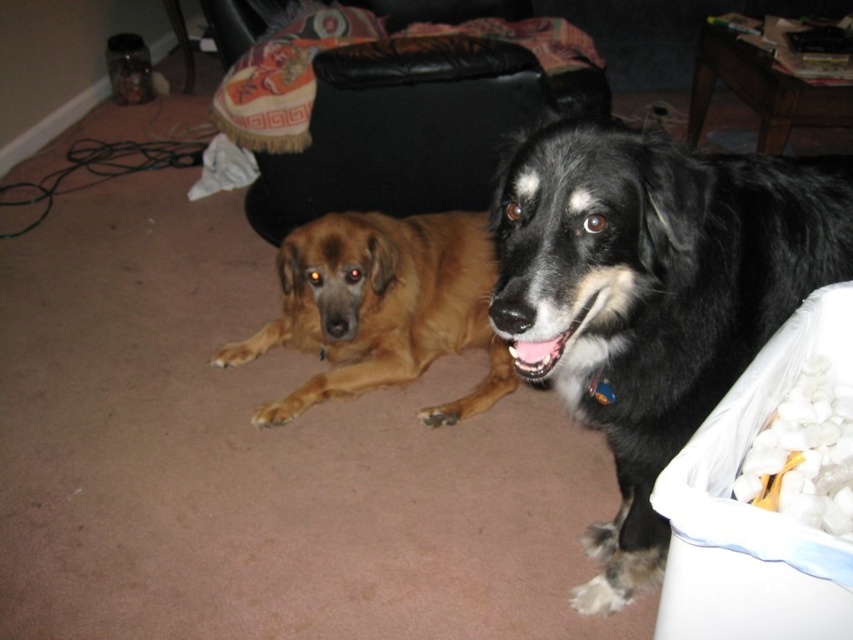
Looking at this image, who is higher up, black fur dog at right or brown furry dog at center?

brown furry dog at center is higher up.

Between point (576, 262) and point (463, 291), which one is positioned in front?

Point (576, 262)

Between point (659, 156) and point (485, 336), which one is positioned in front?

Point (659, 156)

Find the location of `black fur dog at right`. black fur dog at right is located at coordinates (653, 294).